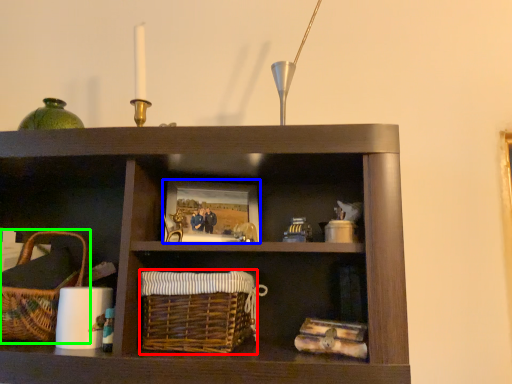
Question: Which object is the closest to the basket (highlighted by a red box)? Choose among these: picture frame (highlighted by a blue box) or picnic basket (highlighted by a green box).

Choices:
 (A) picture frame
 (B) picnic basket

Answer: (A)